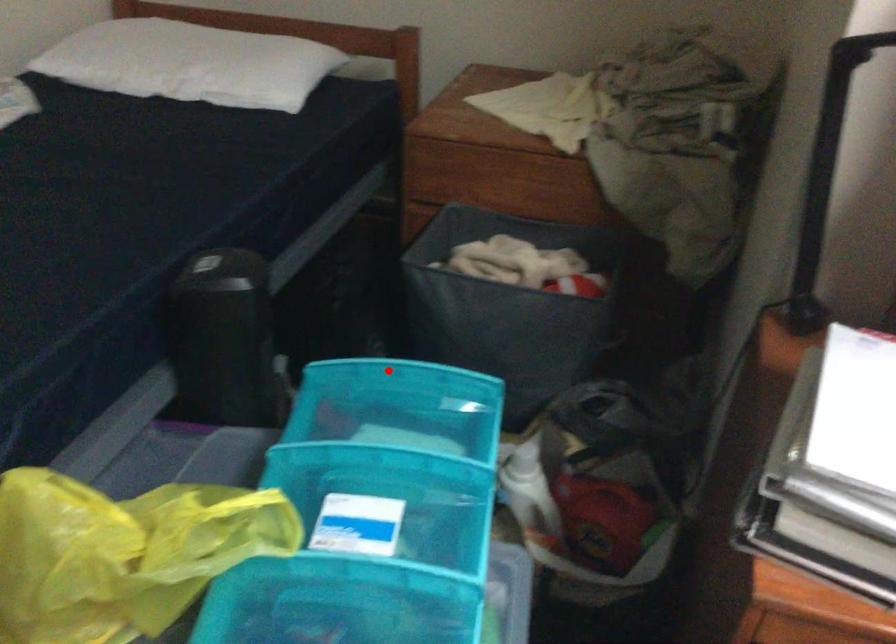
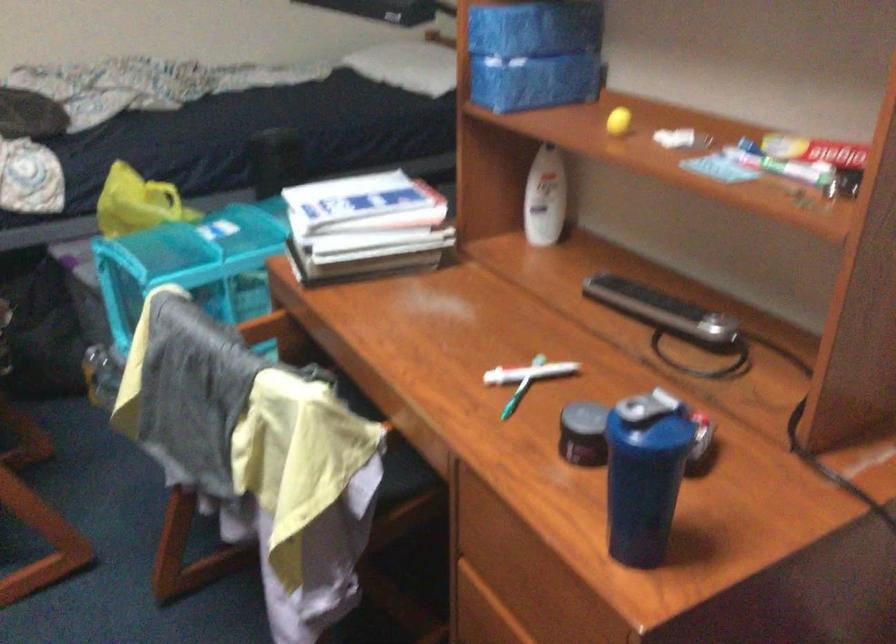
Question: I am providing you with two images of the same scene from different viewpoints. A red point is marked on the first image. Can you still see the location of the red point in image 2?

Choices:
 (A) Yes
 (B) No

Answer: (B)